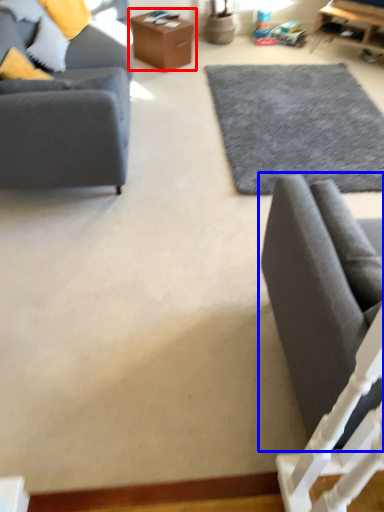
Question: Which point is further to the camera, table (highlighted by a red box) or studio couch (highlighted by a blue box)?

Choices:
 (A) table
 (B) studio couch

Answer: (A)